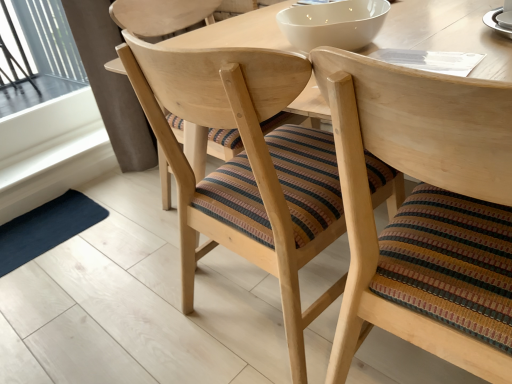
Where is `vacant area that is situated to the right of dark blue fabric mat at lower left`? vacant area that is situated to the right of dark blue fabric mat at lower left is located at coordinates (123, 224).